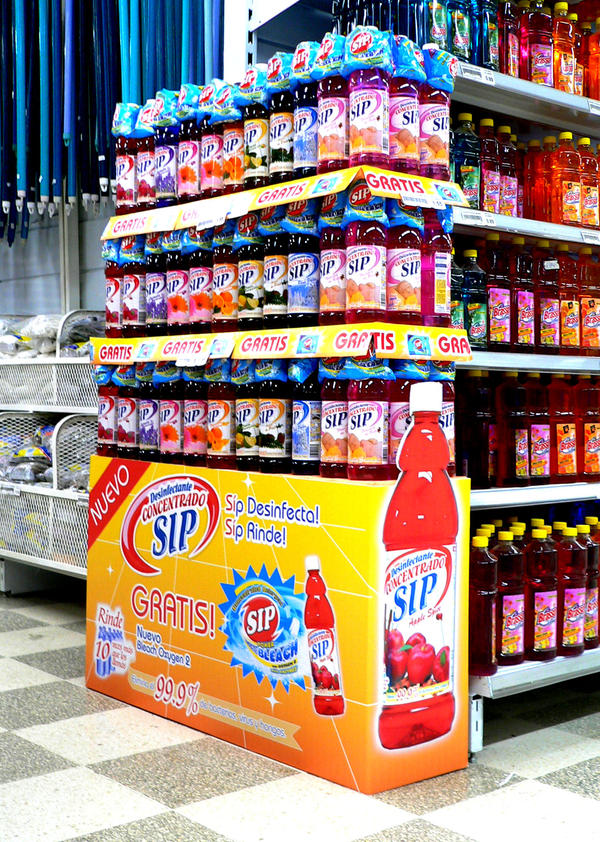
Image resolution: width=600 pixels, height=842 pixels. I want to click on white metal storage buckets, so click(x=54, y=374), click(x=61, y=504).